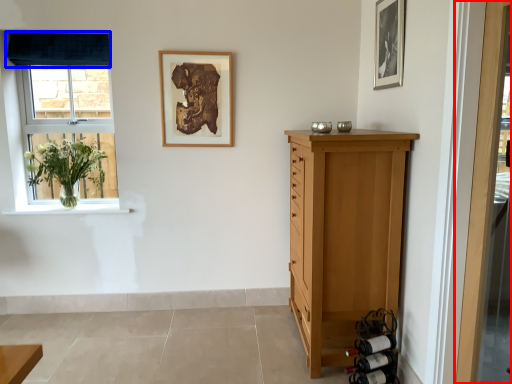
Question: Which object is further to the camera taking this photo, door (highlighted by a red box) or curtain (highlighted by a blue box)?

Choices:
 (A) door
 (B) curtain

Answer: (B)